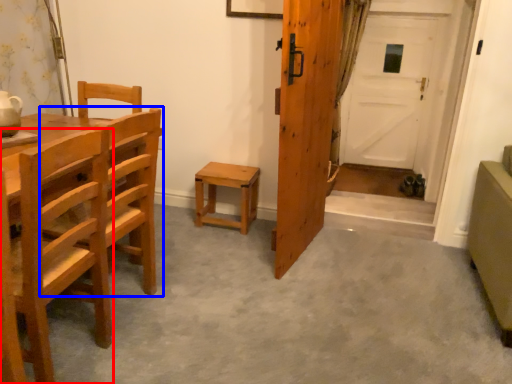
Question: Which object appears farthest to the camera in this image, chair (highlighted by a red box) or chair (highlighted by a blue box)?

Choices:
 (A) chair
 (B) chair

Answer: (B)